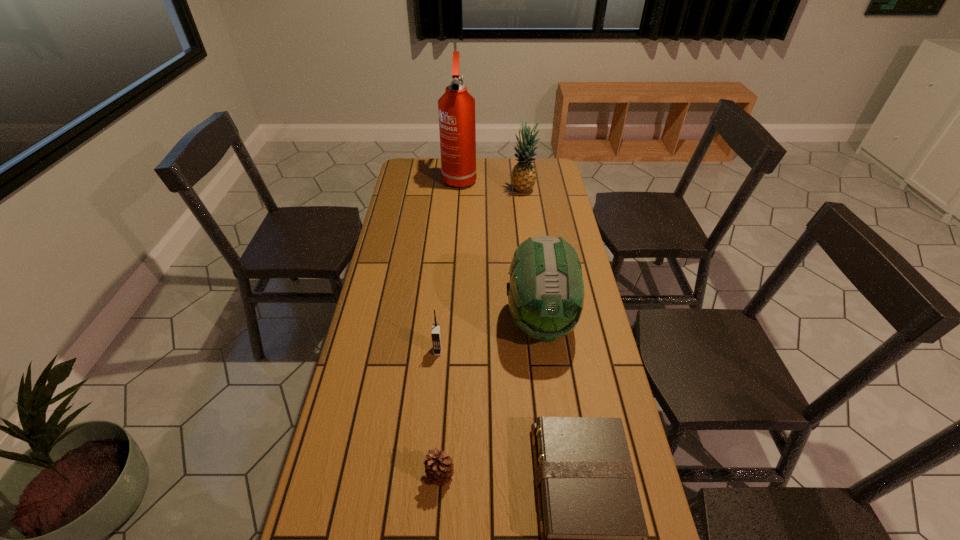
Where is `fire extinguisher at the far edge`? This screenshot has width=960, height=540. fire extinguisher at the far edge is located at coordinates click(456, 107).

The width and height of the screenshot is (960, 540). Find the location of `pineapple present at the far edge`. pineapple present at the far edge is located at coordinates (523, 177).

At what (x,y) coordinates should I click in order to perform the action: click on pineapple present at the right edge. Please return your answer as a coordinate pair (x, y). Looking at the image, I should click on (523, 177).

The width and height of the screenshot is (960, 540). In order to click on football helmet at the right edge in this screenshot , I will do `click(546, 290)`.

Where is `object that is at the far right corner`? object that is at the far right corner is located at coordinates (523, 177).

The width and height of the screenshot is (960, 540). What are the coordinates of `free location at the far edge` in the screenshot? It's located at (511, 164).

Identify the location of blank area at the left edge. (427, 206).

This screenshot has width=960, height=540. In the image, there is a desktop. In order to click on vacant space at the right edge in this screenshot , I will do `click(549, 225)`.

Locate an element on the screen. The image size is (960, 540). unoccupied position between the fourth tallest object and the football helmet is located at coordinates (490, 336).

Image resolution: width=960 pixels, height=540 pixels. I want to click on vacant area between the fourth tallest object and the pineapple, so click(x=481, y=271).